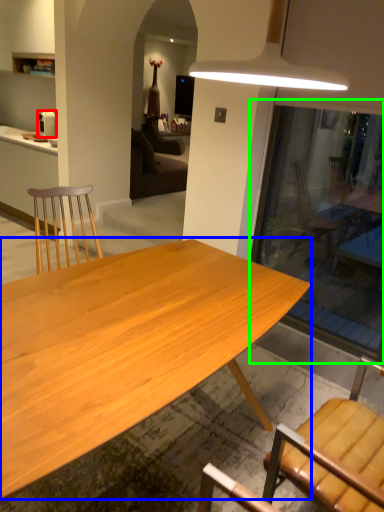
Question: Which object is the closest to the coffee maker (highlighted by a red box)? Choose among these: desk (highlighted by a blue box) or glass door (highlighted by a green box).

Choices:
 (A) desk
 (B) glass door

Answer: (B)